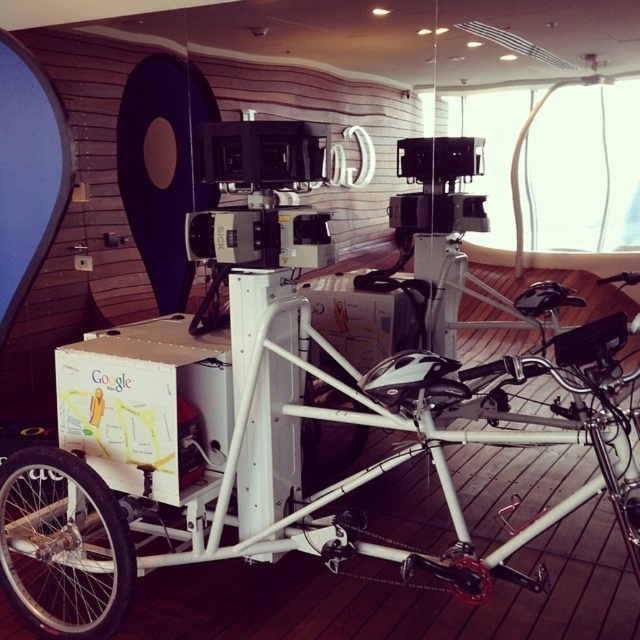
Does point (6, 518) come farther from viewer compared to point (305, 460)?

No, it is not.

This screenshot has width=640, height=640. In order to click on black rubber wheel at lower left in this screenshot , I will do `click(61, 547)`.

Can you confirm if black rubber wheel at lower left is shorter than white cardboard box at center?

No, black rubber wheel at lower left is not shorter than white cardboard box at center.

Who is more distant from viewer, (x=4, y=524) or (x=358, y=353)?

The point (x=358, y=353) is behind.

At what (x,y) coordinates should I click in order to perform the action: click on black rubber wheel at lower left. Please return your answer as a coordinate pair (x, y). Image resolution: width=640 pixels, height=640 pixels. Looking at the image, I should click on (61, 547).

Is point (522, 368) closer to camera compared to point (74, 508)?

That is True.

From the picture: Does white matte bicycle at center appear on the right side of black rubber wheel at lower left?

Yes, white matte bicycle at center is to the right of black rubber wheel at lower left.

The image size is (640, 640). What do you see at coordinates (278, 454) in the screenshot?
I see `white matte bicycle at center` at bounding box center [278, 454].

You are a GUI agent. You are given a task and a screenshot of the screen. Output one action in this format:
    pyautogui.click(x=<x>, y=<y>)
    Task: Click on the white matte bicycle at center
    The height and width of the screenshot is (640, 640).
    Given the screenshot: What is the action you would take?
    pyautogui.click(x=278, y=454)